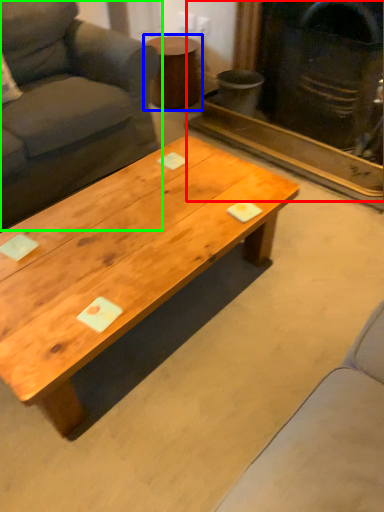
Question: Based on their relative distances, which object is nearer to fireplace (highlighted by a red box)? Choose from side table (highlighted by a blue box) and studio couch (highlighted by a green box).

Choices:
 (A) side table
 (B) studio couch

Answer: (A)